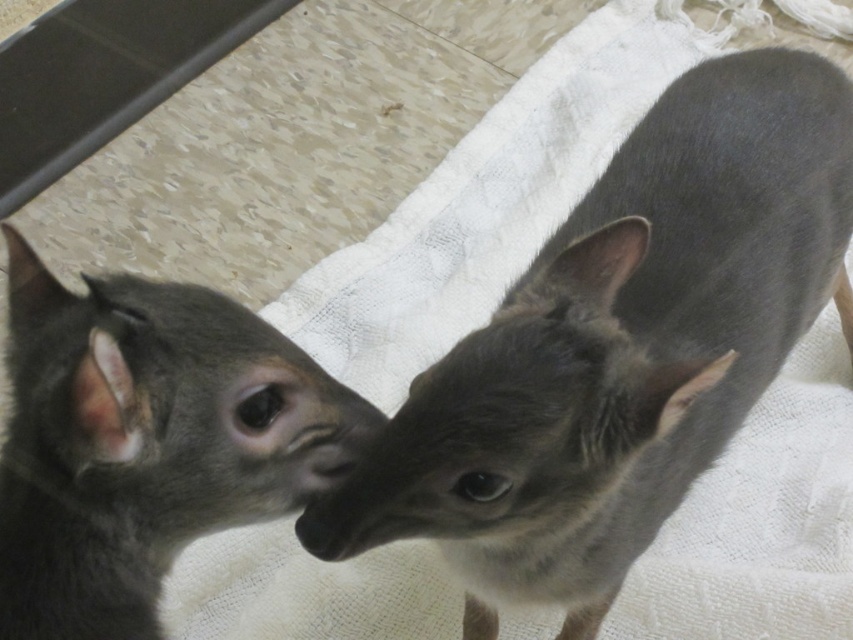
Question: Which point appears farthest from the camera in this image?

Choices:
 (A) (216, 412)
 (B) (428, 516)

Answer: (B)

Question: Which of the following is the farthest from the observer?

Choices:
 (A) (183, 353)
 (B) (585, 212)

Answer: (B)

Question: Can you confirm if smooth gray chihuahua at center is bigger than gray matte fur at center?

Choices:
 (A) yes
 (B) no

Answer: (A)

Question: From the image, what is the correct spatial relationship of smooth gray chihuahua at center in relation to gray matte fur at center?

Choices:
 (A) above
 (B) below

Answer: (B)

Question: Can you confirm if smooth gray chihuahua at center is positioned below gray matte fur at center?

Choices:
 (A) yes
 (B) no

Answer: (A)